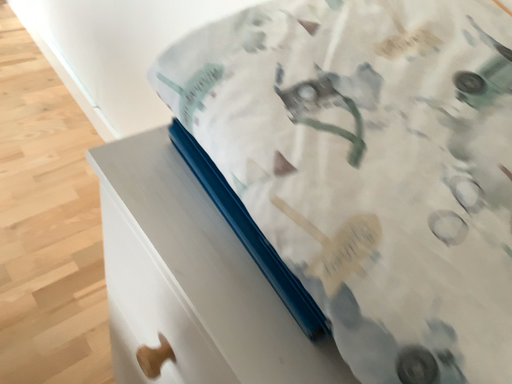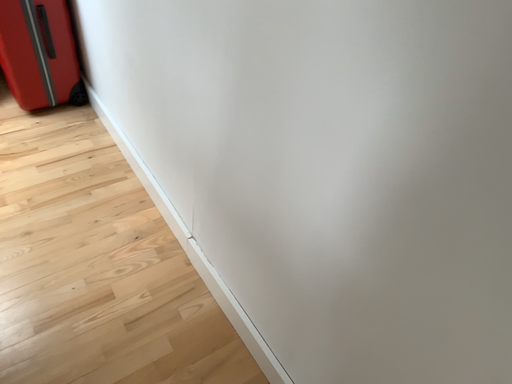
Question: Which way did the camera rotate in the video?

Choices:
 (A) rotated left
 (B) rotated right

Answer: (A)